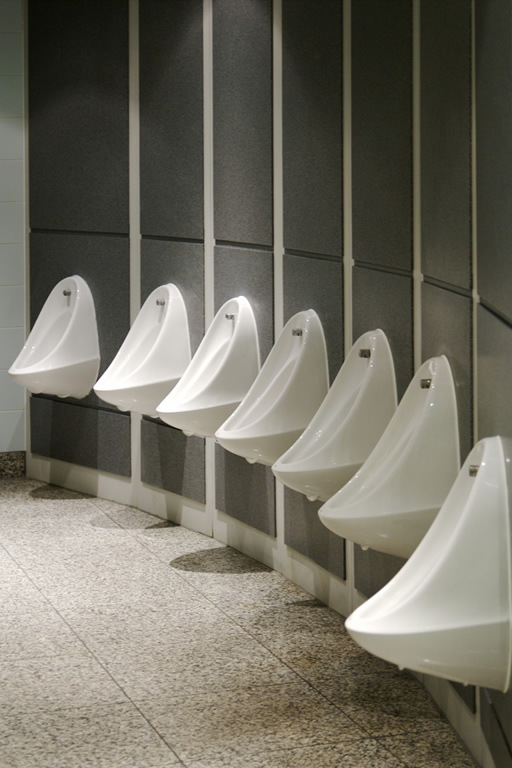
The width and height of the screenshot is (512, 768). What are the coordinates of `urinal's` in the screenshot? It's located at (50, 339), (146, 349), (211, 368), (273, 396), (331, 416), (390, 467), (438, 553).